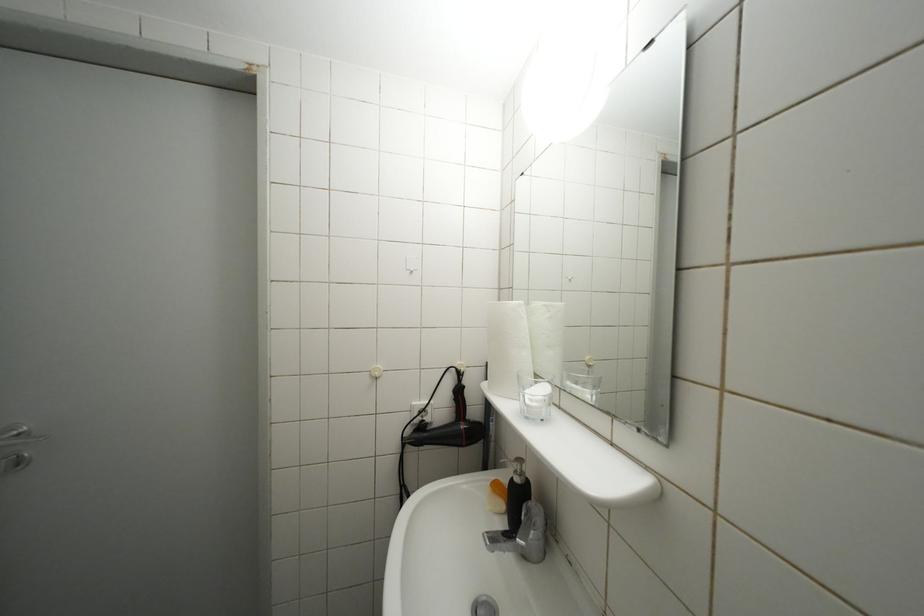
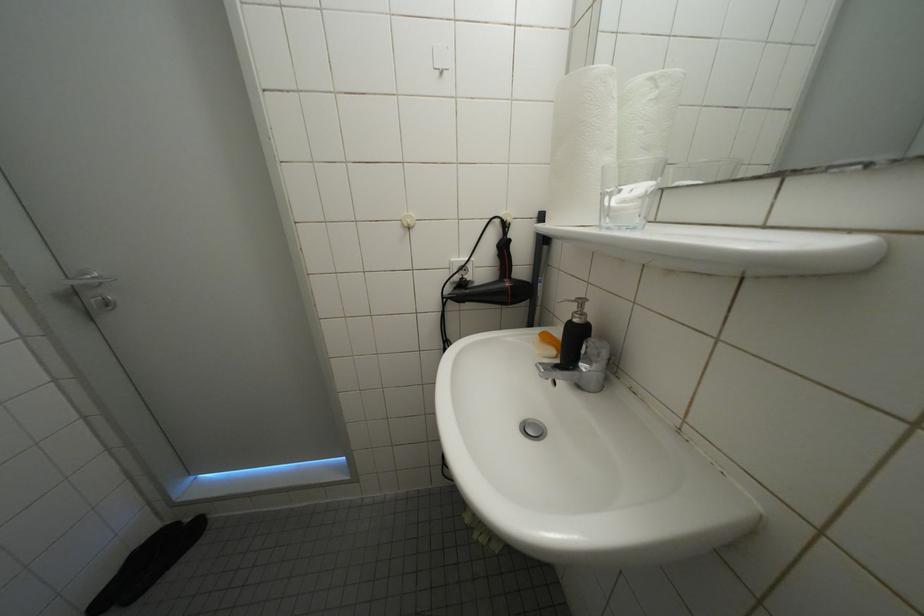
The images are taken continuously from a first-person perspective. In which direction are you moving?

The movement direction of the cameraman is left, forward.